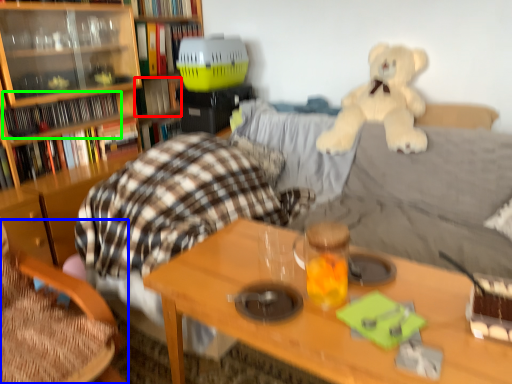
Question: Which object is positioned farthest from book (highlighted by a red box)? Select from chair (highlighted by a blue box) and book (highlighted by a green box).

Choices:
 (A) chair
 (B) book

Answer: (A)